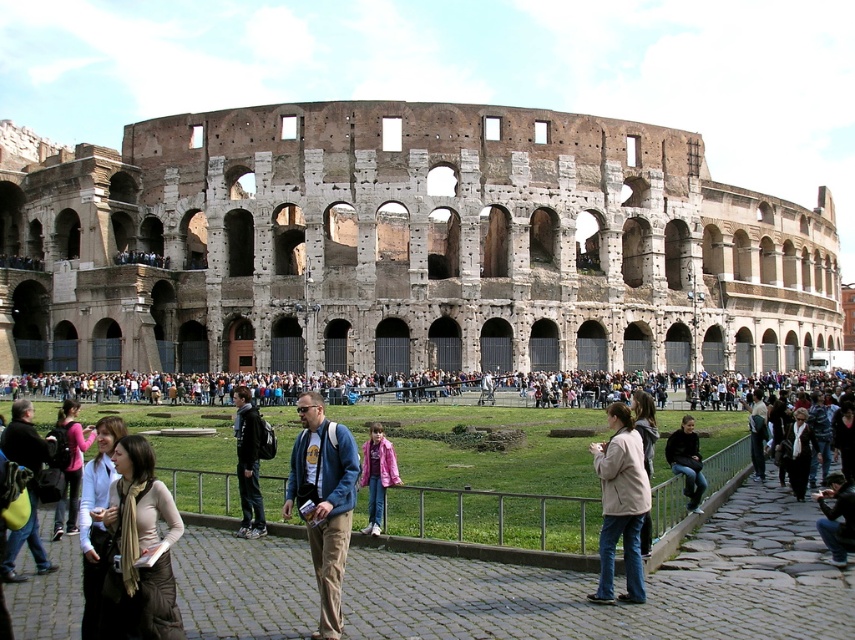
You are a photographer planning to take a photo of the Colosseum with the two jackets in the foreground. The brown leather jacket at lower left and the pink fabric jacket at center are both in your frame. Which jacket should you focus on if you want to capture the one that is taller?

The pink fabric jacket at center is taller than the brown leather jacket at lower left, so you should focus on the pink fabric jacket at center to capture the taller one.

You are standing at the Colosseum and want to take a photo of both the point at coordinates (86, 518) and the point at (649, 524). Which point should you focus on first to ensure both are in the frame?

You should focus on point (86, 518) first because it is closer to the viewer, ensuring both points will be in the frame when the camera adjusts for depth.

You are a photographer standing at the Colosseum. You notice two jackets in the scene. The brown leather jacket at lower left and the pink fabric jacket at center. Which jacket is positioned to the left of the other?

The brown leather jacket at lower left is positioned on the left side of pink fabric jacket at center.